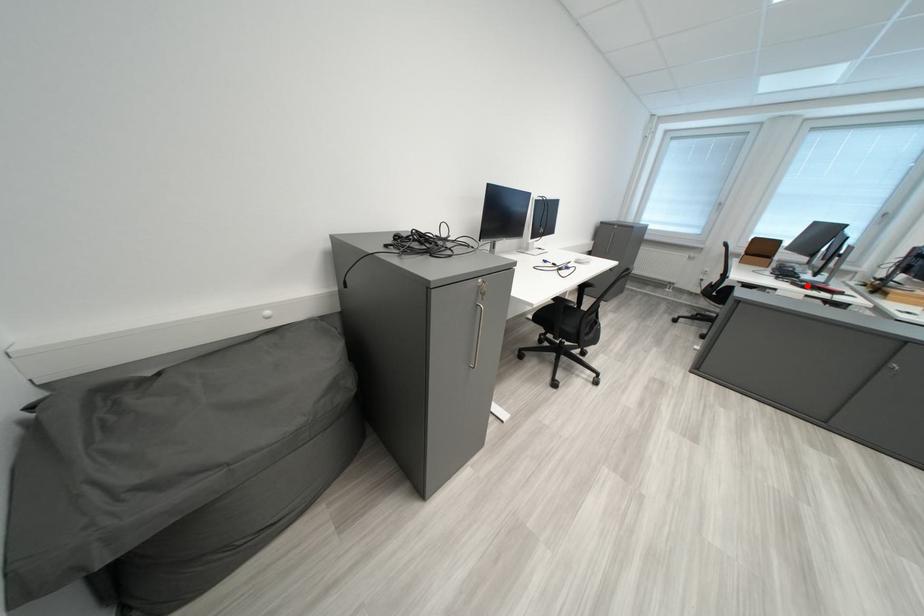
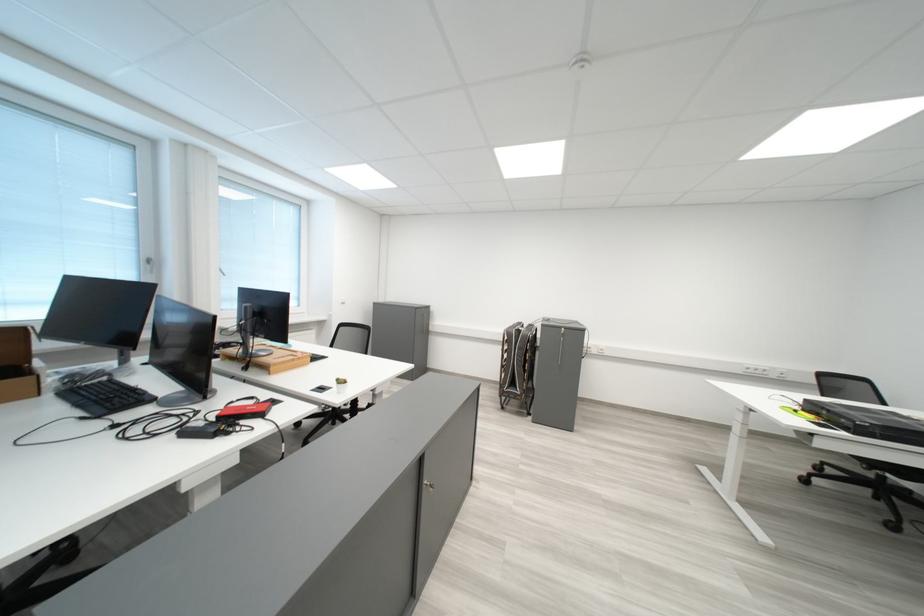
Where in the second image is the point corresponding to the highlighted location from the first image?

(200, 436)